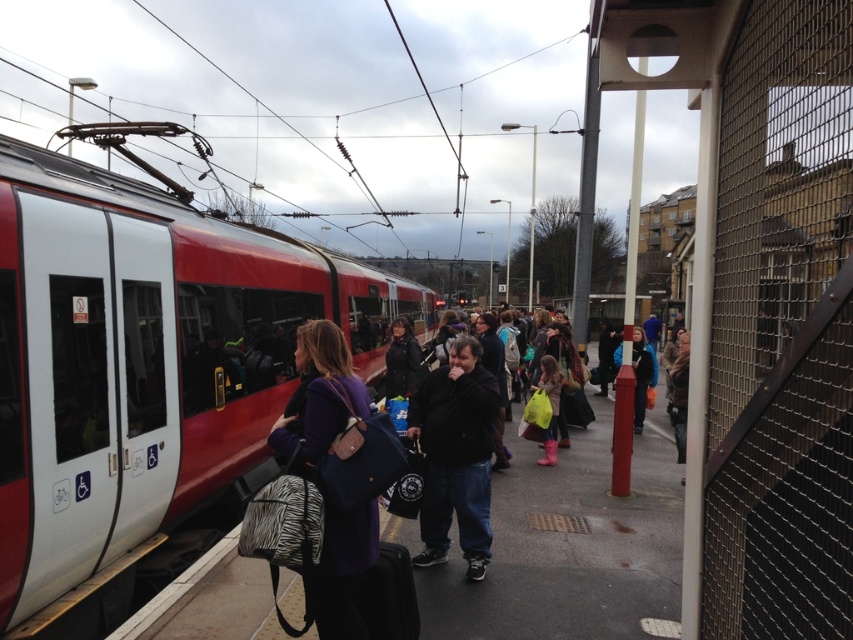
You are a traveler standing on the train platform and notice two jackets left unattended on a bench. The jackets are the dark blue fabric jacket at center and the black cotton jacket at center. Which jacket is narrower in width?

The dark blue fabric jacket at center is narrower in width than the black cotton jacket at center according to the description.